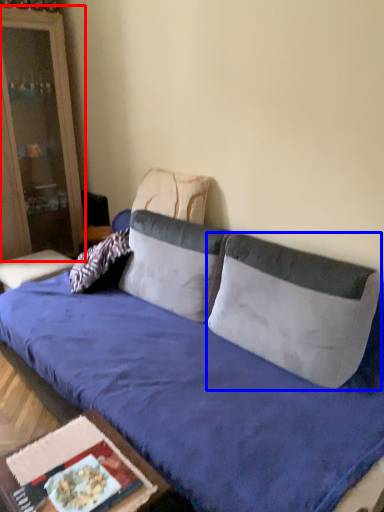
Question: Which object appears farthest to the camera in this image, cabinetry (highlighted by a red box) or pillow (highlighted by a blue box)?

Choices:
 (A) cabinetry
 (B) pillow

Answer: (A)